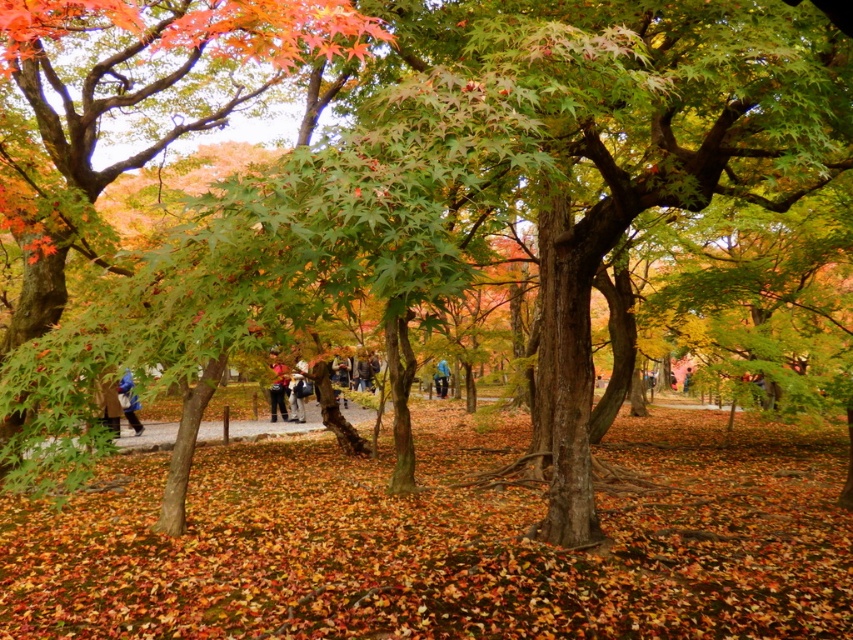
Question: From the image, what is the correct spatial relationship of blue fabric jacket at lower left in relation to blue fabric jacket at center?

Choices:
 (A) above
 (B) below

Answer: (A)

Question: Which object is closer to the camera taking this photo?

Choices:
 (A) blue fabric jacket at center
 (B) blue fabric jacket at lower left

Answer: (B)

Question: Is blue fabric jacket at lower left above blue fabric jacket at center?

Choices:
 (A) no
 (B) yes

Answer: (B)

Question: Is blue fabric jacket at lower left further to camera compared to blue fabric jacket at center?

Choices:
 (A) no
 (B) yes

Answer: (A)

Question: Among these objects, which one is farthest from the camera?

Choices:
 (A) blue fabric jacket at center
 (B) blue fabric jacket at lower left

Answer: (A)